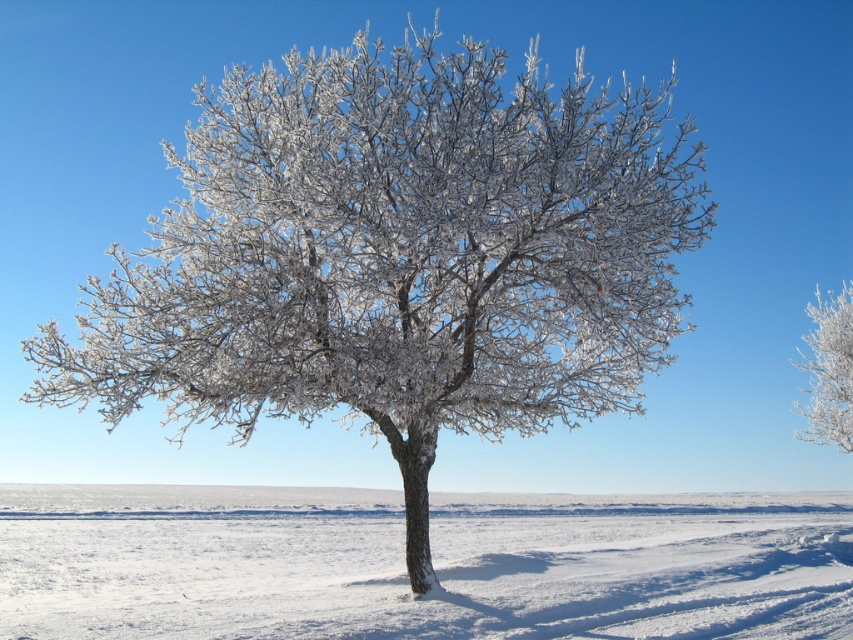
Between point (527, 520) and point (807, 356), which one is positioned in front?

Point (527, 520) is in front.

Is white frosty snow at center below frosted white tree at right?

Correct, white frosty snow at center is located below frosted white tree at right.

Where is `white frosty snow at center`? white frosty snow at center is located at coordinates (404, 564).

Locate an element on the screen. white frosty snow at center is located at coordinates (404, 564).